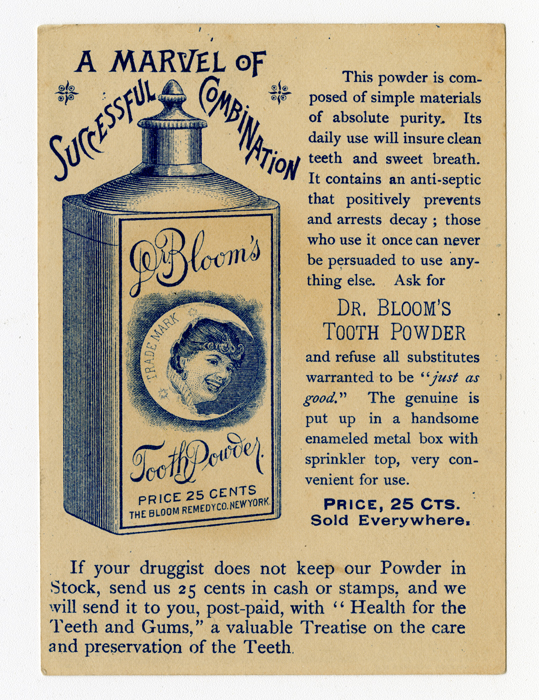
The image size is (539, 700). Identify the location of poster. (283, 56).